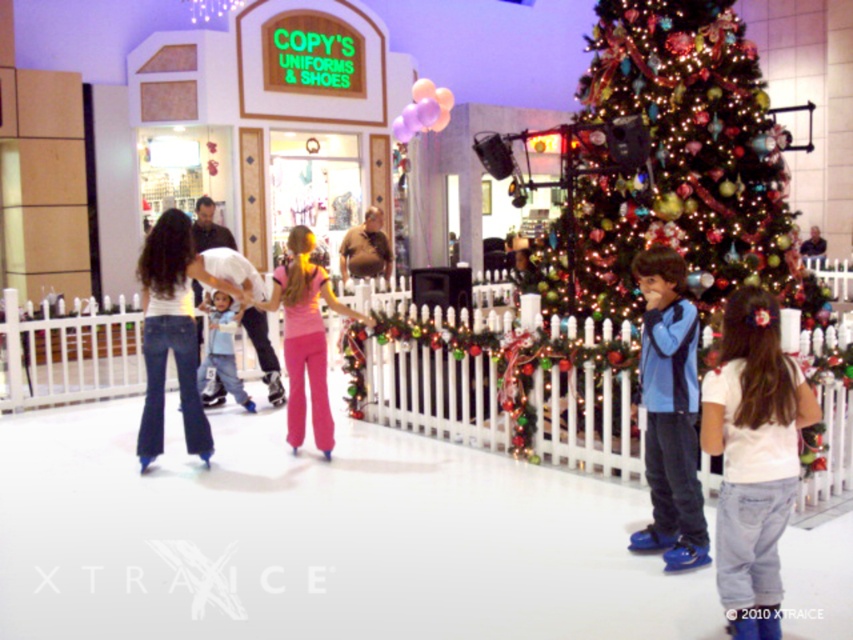
You are at the ice rink and see two people skating. One is wearing denim jeans at center and the other has light blue fabric pants at center. Which person is positioned to the right side?

The denim jeans at center is to the right of the light blue fabric pants at center, so the person wearing denim jeans at center is positioned to the right side.

In the scene shown: You are at the ice rink and see the shiny green christmas tree at center and the pink fabric pants at center. From the perspective of someone standing at the center of the rink, which object is located to the right?

The shiny green christmas tree at center is to the right of the pink fabric pants at center.

You are a photographer standing at the edge of the ice rink. You want to take a photo focusing on the white cotton shirt at center and the blue synthetic skates at center. Which object will appear larger in your photo?

The white cotton shirt at center will appear larger in the photo because it is closer to the viewer than the blue synthetic skates at center.